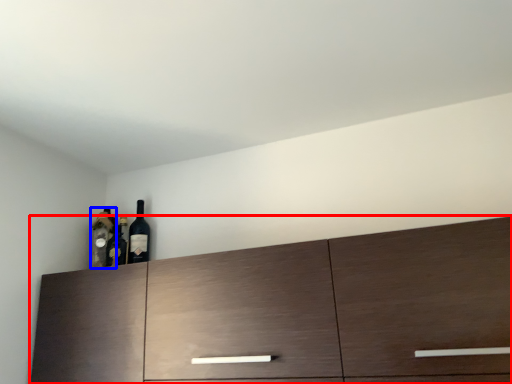
Question: Among these objects, which one is farthest to the camera, cabinetry (highlighted by a red box) or bottle (highlighted by a blue box)?

Choices:
 (A) cabinetry
 (B) bottle

Answer: (B)